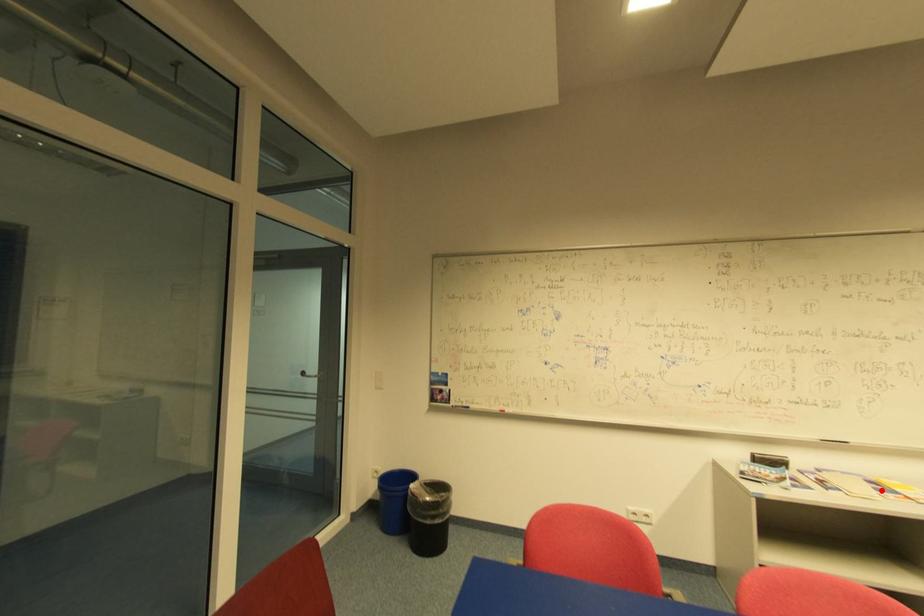
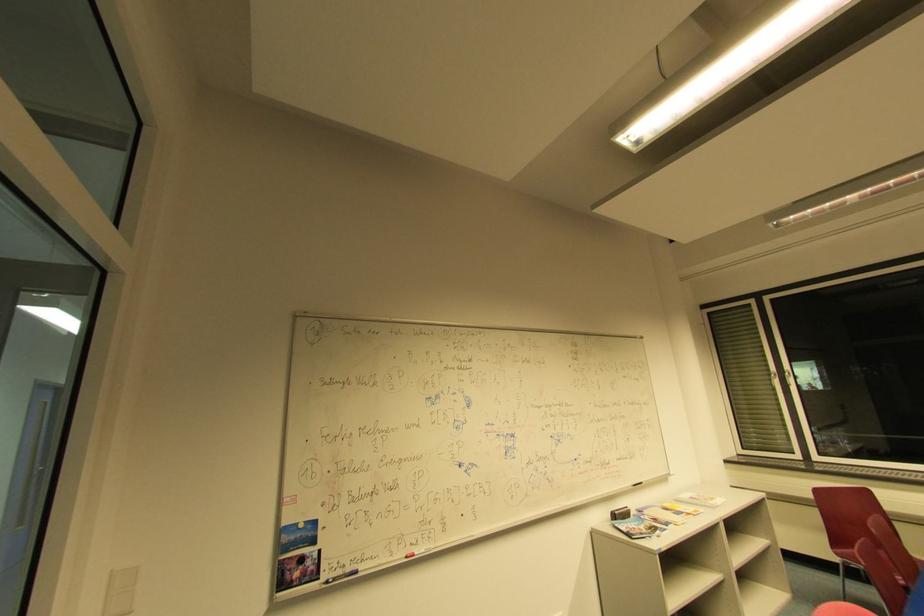
Locate, in the second image, the point that corresponds to the highlighted location in the first image.

(679, 515)